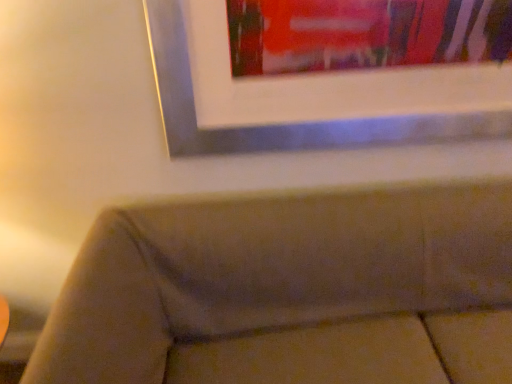
Question: Visually, is velvet beige couch at lower center positioned to the left or to the right of metallic silver picture frame at upper center?

Choices:
 (A) left
 (B) right

Answer: (B)

Question: Considering the positions of point (342, 228) and point (354, 122), is point (342, 228) closer or farther from the camera than point (354, 122)?

Choices:
 (A) closer
 (B) farther

Answer: (B)

Question: From a real-world perspective, is velvet beige couch at lower center above or below metallic silver picture frame at upper center?

Choices:
 (A) below
 (B) above

Answer: (A)

Question: Looking at their shapes, would you say metallic silver picture frame at upper center is wider or thinner than velvet beige couch at lower center?

Choices:
 (A) thin
 (B) wide

Answer: (A)

Question: In the image, is metallic silver picture frame at upper center positioned in front of or behind velvet beige couch at lower center?

Choices:
 (A) front
 (B) behind

Answer: (B)

Question: In terms of size, does metallic silver picture frame at upper center appear bigger or smaller than velvet beige couch at lower center?

Choices:
 (A) small
 (B) big

Answer: (A)

Question: Considering the positions of metallic silver picture frame at upper center and velvet beige couch at lower center in the image, is metallic silver picture frame at upper center taller or shorter than velvet beige couch at lower center?

Choices:
 (A) tall
 (B) short

Answer: (B)